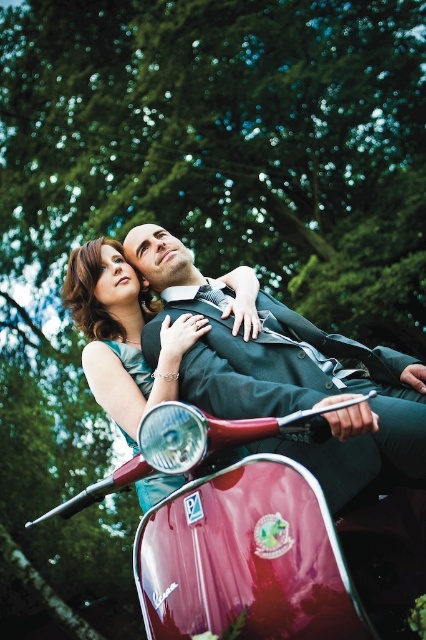
You are a photographer trying to capture a candid shot of the shiny black suit at center and the satin teal dress at lower left. Since you want to ensure both subjects are in focus, you need to know their vertical positions. Which object is higher in the image?

The shiny black suit at center is positioned over the satin teal dress at lower left, so the shiny black suit at center is higher in the image.

What is located at the coordinates point (287, 374)?

The shiny black suit at center is located at point (287, 374).

You are a photographer aiming to capture the couple on the glossy red scooter at center and the shiny black suit at center. To ensure both subjects are in focus, you need to know their vertical positions. Which object is positioned lower in the image?

The glossy red scooter at center is located below the shiny black suit at center, so the glossy red scooter at center is positioned lower in the image.